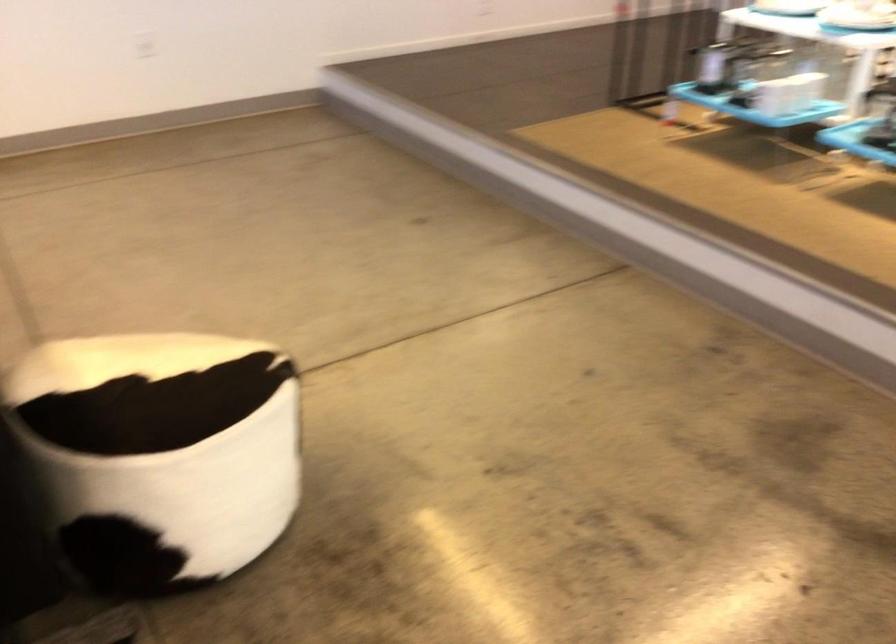
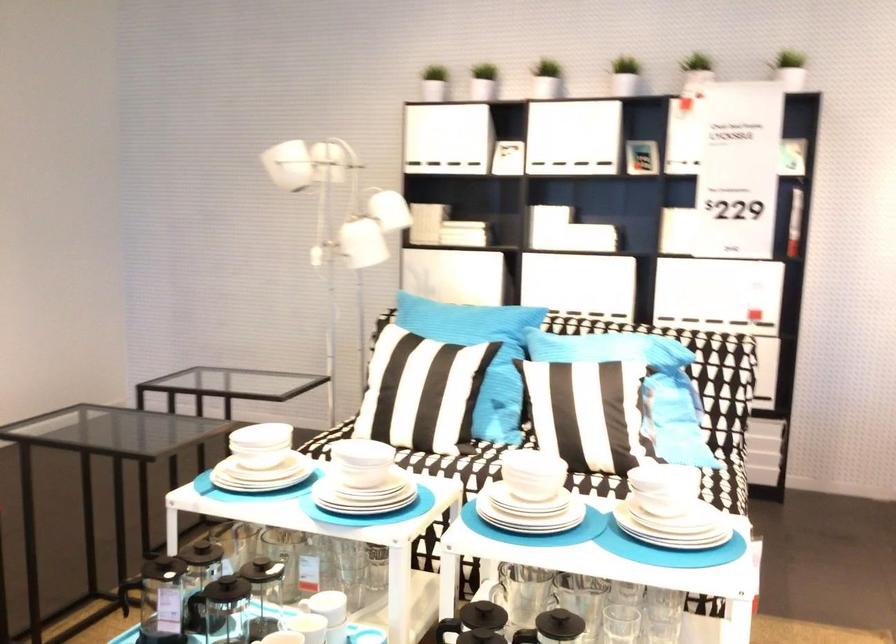
Where in the second image is the point corresponding to point 789,82 from the first image?

(304, 629)